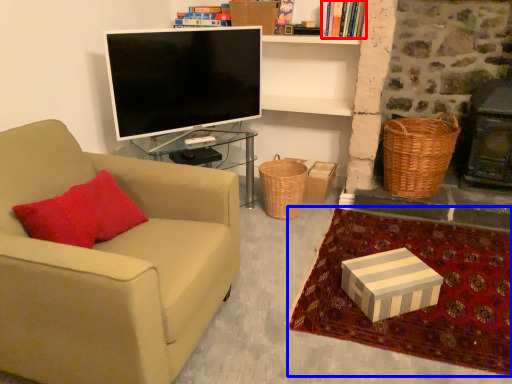
Question: Among these objects, which one is farthest to the camera, book (highlighted by a red box) or blanket (highlighted by a blue box)?

Choices:
 (A) book
 (B) blanket

Answer: (A)